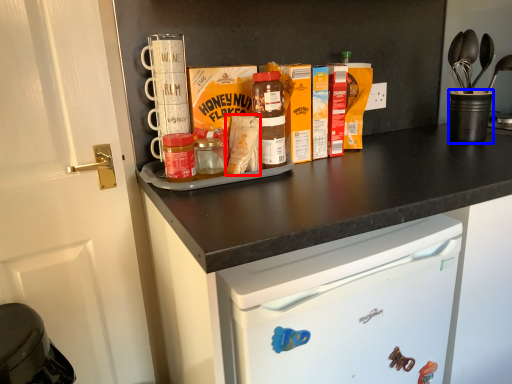
Question: Which object is closer to the camera taking this photo, cereal (highlighted by a red box) or appliance (highlighted by a blue box)?

Choices:
 (A) cereal
 (B) appliance

Answer: (A)